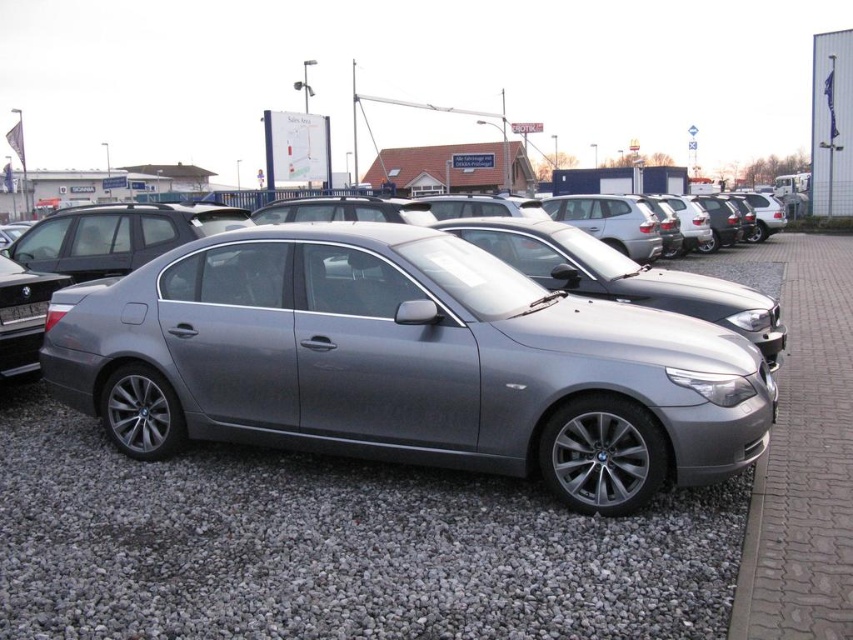
Describe the element at coordinates (405, 364) in the screenshot. The image size is (853, 640). I see `satin metallic sedan at center` at that location.

Does satin metallic sedan at center have a smaller size compared to gray gravel at center?

Actually, satin metallic sedan at center might be larger than gray gravel at center.

Is point (428, 368) closer to viewer compared to point (262, 566)?

No.

In order to click on satin metallic sedan at center in this screenshot , I will do `click(405, 364)`.